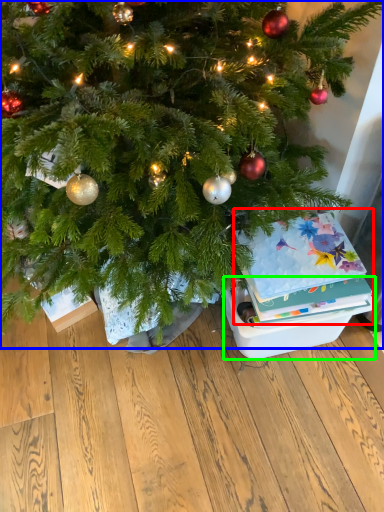
Question: Which object is positioned closest to christmas card (highlighted by a red box)? Select from christmas tree (highlighted by a blue box) and storage box (highlighted by a green box).

Choices:
 (A) christmas tree
 (B) storage box

Answer: (B)